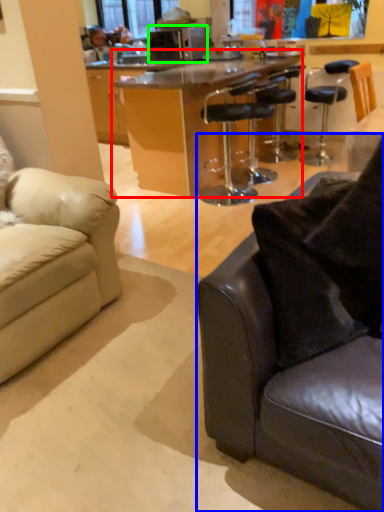
Question: Based on their relative distances, which object is farther from table (highlighted by a red box)? Choose from studio couch (highlighted by a blue box) and microwave oven (highlighted by a green box).

Choices:
 (A) studio couch
 (B) microwave oven

Answer: (A)